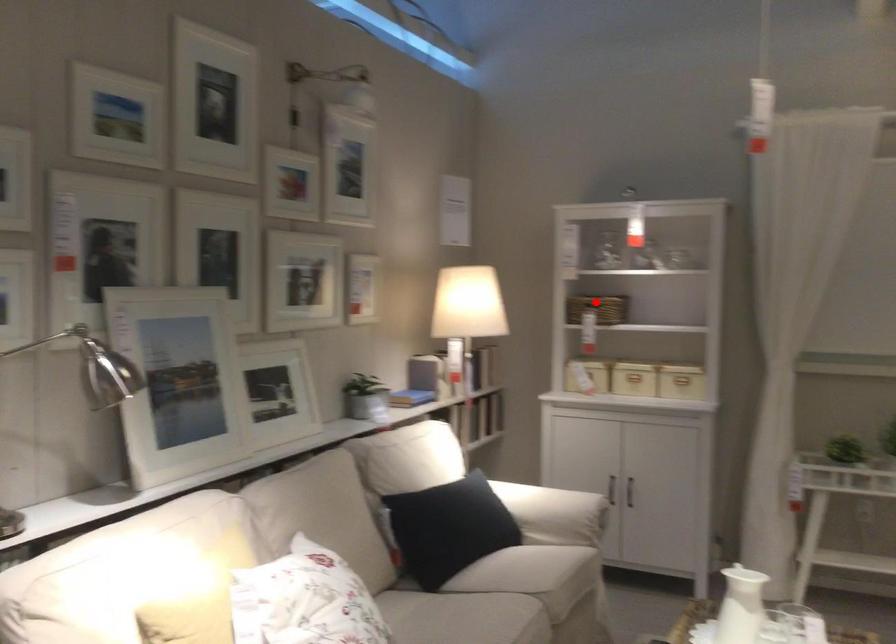
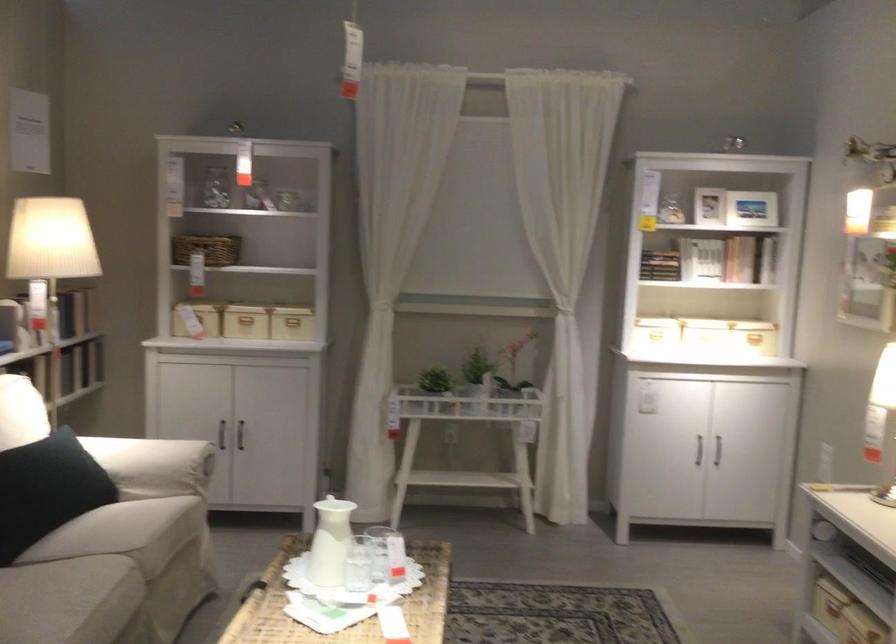
In the second image, find the point that corresponds to the highlighted location in the first image.

(207, 249)